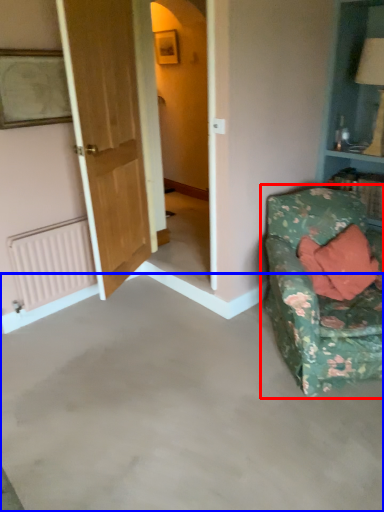
Question: Which of the following is the farthest to the observer, studio couch (highlighted by a red box) or concrete (highlighted by a blue box)?

Choices:
 (A) studio couch
 (B) concrete

Answer: (A)